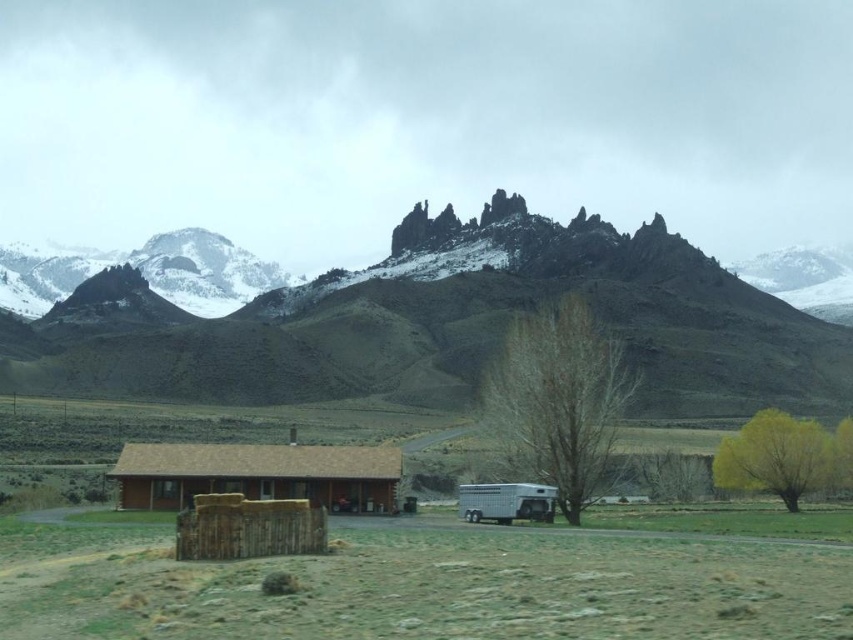
Does point (729, 328) lie behind point (518, 513)?

Yes, it is.

Where is `rugged rock formation at center`? The width and height of the screenshot is (853, 640). rugged rock formation at center is located at coordinates (444, 324).

Is point (502, 236) in front of point (515, 496)?

No, (502, 236) is further to viewer.

Identify the location of rugged rock formation at center. 444,324.

Can you confirm if brown log cabin at center is thinner than yellow leafy tree at lower right?

No, brown log cabin at center is not thinner than yellow leafy tree at lower right.

Who is higher up, brown log cabin at center or yellow leafy tree at lower right?

brown log cabin at center

The height and width of the screenshot is (640, 853). In order to click on brown log cabin at center in this screenshot , I will do `click(257, 474)`.

Who is shorter, bare wood tree at center or white glossy horse trailer at lower right?

Standing shorter between the two is white glossy horse trailer at lower right.

Can you confirm if bare wood tree at center is positioned to the right of white glossy horse trailer at lower right?

Yes, bare wood tree at center is to the right of white glossy horse trailer at lower right.

Between point (497, 444) and point (482, 484), which one is positioned in front?

Point (482, 484) is in front.

Identify the location of bare wood tree at center. (556, 401).